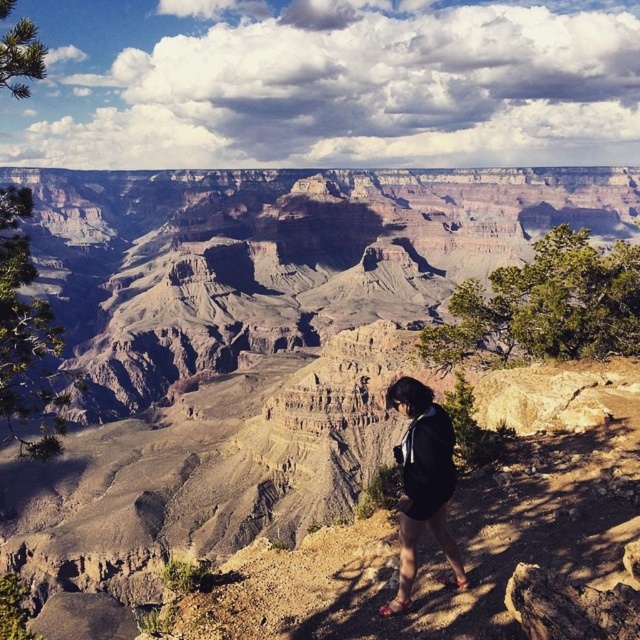
Can you confirm if brown rocky canyon at center is smaller than black fabric shorts at lower right?

No.

Is brown rocky canyon at center to the left of black fabric shorts at lower right from the viewer's perspective?

Incorrect, brown rocky canyon at center is not on the left side of black fabric shorts at lower right.

This screenshot has height=640, width=640. I want to click on brown rocky canyon at center, so click(248, 344).